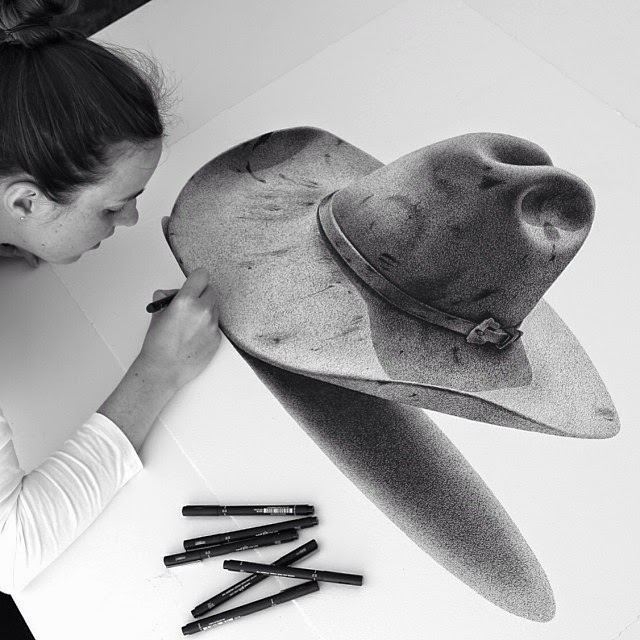
You are a GUI agent. You are given a task and a screenshot of the screen. Output one action in this format:
    pyautogui.click(x=<x>, y=<y>)
    Task: Click on the white table
    The image size is (640, 640).
    Given the screenshot: What is the action you would take?
    pyautogui.click(x=123, y=611)